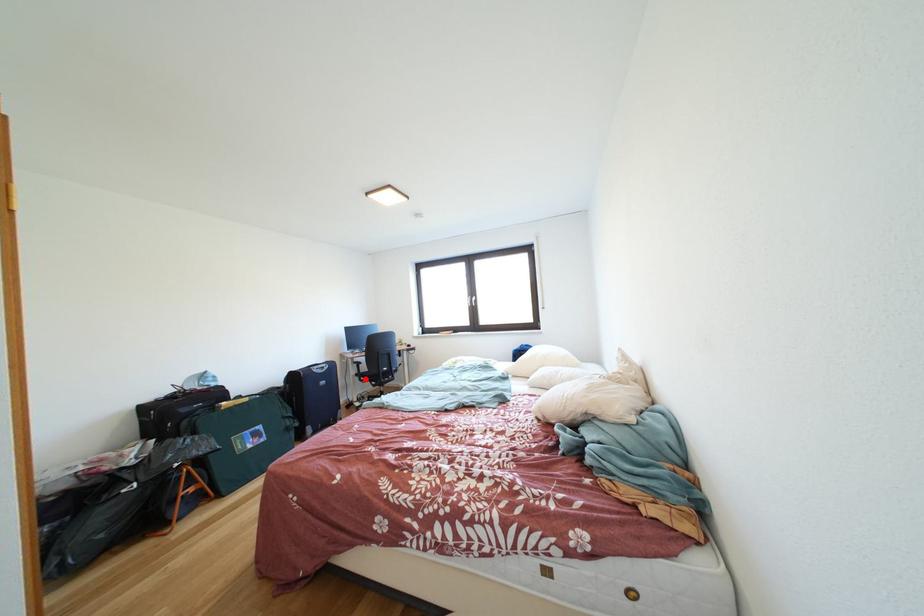
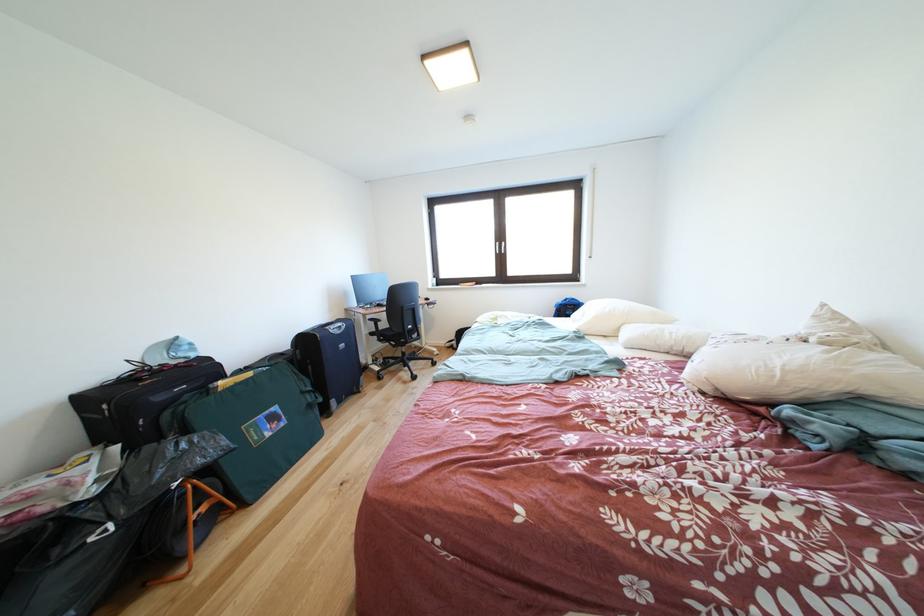
Locate, in the second image, the point that corresponds to the highlighted location in the first image.

(380, 339)